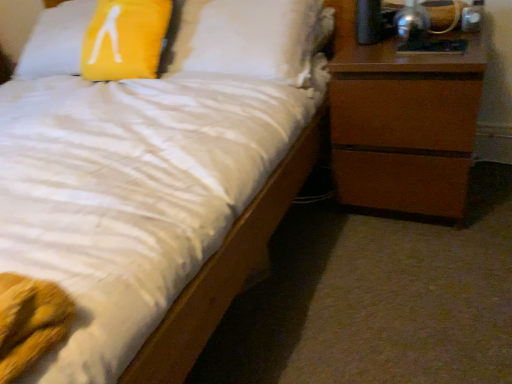
Question: Is metallic silver lamp at upper right oriented away from brown wood chest of drawers at right?

Choices:
 (A) yes
 (B) no

Answer: (B)

Question: Considering the relative sizes of metallic silver lamp at upper right and brown wood chest of drawers at right in the image provided, is metallic silver lamp at upper right thinner than brown wood chest of drawers at right?

Choices:
 (A) yes
 (B) no

Answer: (A)

Question: Considering the relative sizes of metallic silver lamp at upper right and brown wood chest of drawers at right in the image provided, is metallic silver lamp at upper right wider than brown wood chest of drawers at right?

Choices:
 (A) no
 (B) yes

Answer: (A)

Question: Can you confirm if metallic silver lamp at upper right is smaller than brown wood chest of drawers at right?

Choices:
 (A) no
 (B) yes

Answer: (B)

Question: From the image's perspective, is metallic silver lamp at upper right over brown wood chest of drawers at right?

Choices:
 (A) no
 (B) yes

Answer: (B)

Question: From the image's perspective, is metallic silver lamp at upper right located beneath brown wood chest of drawers at right?

Choices:
 (A) yes
 (B) no

Answer: (B)

Question: Is yellow fabric pillow at upper left further to camera compared to metallic silver lamp at upper right?

Choices:
 (A) yes
 (B) no

Answer: (A)

Question: Is yellow fabric pillow at upper left positioned in front of metallic silver lamp at upper right?

Choices:
 (A) no
 (B) yes

Answer: (A)

Question: Would you consider yellow fabric pillow at upper left to be distant from metallic silver lamp at upper right?

Choices:
 (A) no
 (B) yes

Answer: (B)

Question: Is yellow fabric pillow at upper left completely or partially outside of metallic silver lamp at upper right?

Choices:
 (A) yes
 (B) no

Answer: (A)

Question: Can you confirm if yellow fabric pillow at upper left is thinner than metallic silver lamp at upper right?

Choices:
 (A) no
 (B) yes

Answer: (A)

Question: From a real-world perspective, is yellow fabric pillow at upper left located higher than metallic silver lamp at upper right?

Choices:
 (A) no
 (B) yes

Answer: (A)

Question: Is metallic silver lamp at upper right wider than yellow fabric pillow at upper left?

Choices:
 (A) no
 (B) yes

Answer: (A)